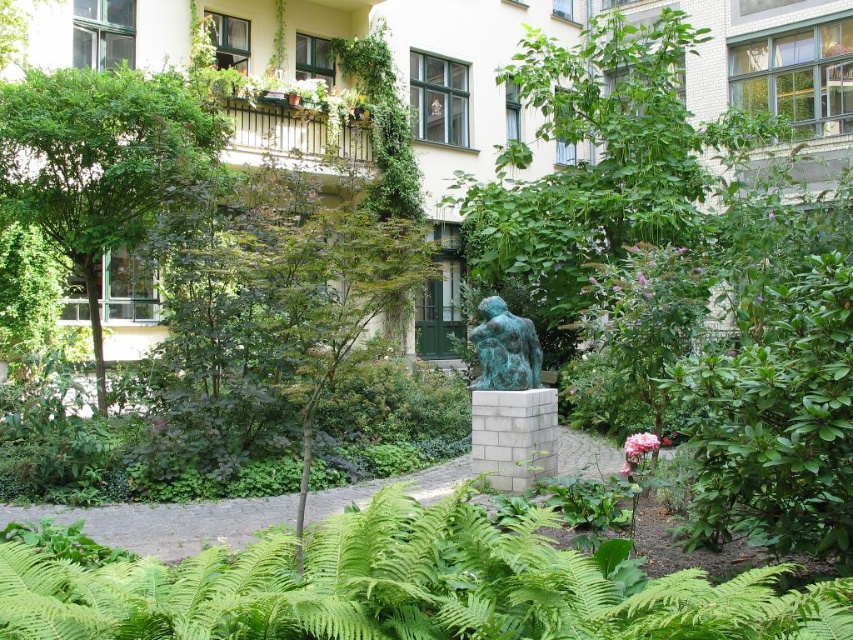
Question: In this image, where is green leafy fern at lower center located relative to green patina statue at center?

Choices:
 (A) above
 (B) below

Answer: (B)

Question: Can you confirm if green leafy fern at lower center is positioned to the left of green patina statue at center?

Choices:
 (A) yes
 (B) no

Answer: (A)

Question: Can you confirm if green leafy tree at upper left is positioned to the left of green patina statue at center?

Choices:
 (A) yes
 (B) no

Answer: (A)

Question: Which object is the farthest from the green patina statue at center?

Choices:
 (A) green leafy tree at upper left
 (B) green leafy fern at lower center

Answer: (A)

Question: Considering the real-world distances, which object is farthest from the green leafy tree at upper left?

Choices:
 (A) green patina statue at center
 (B) green leafy fern at lower center

Answer: (B)

Question: Which point appears farthest from the camera in this image?

Choices:
 (A) pos(56,168)
 (B) pos(492,349)
 (C) pos(428,541)

Answer: (A)